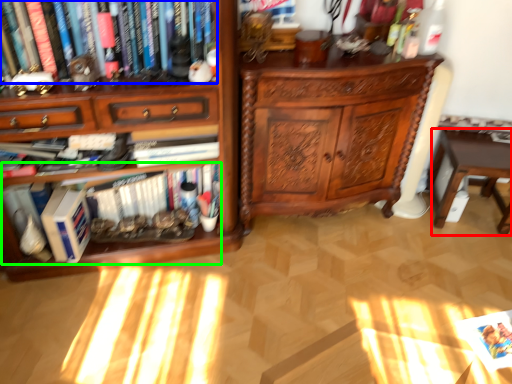
Question: Considering the real-world distances, which object is closest to table (highlighted by a red box)? book (highlighted by a blue box) or book (highlighted by a green box).

Choices:
 (A) book
 (B) book

Answer: (B)